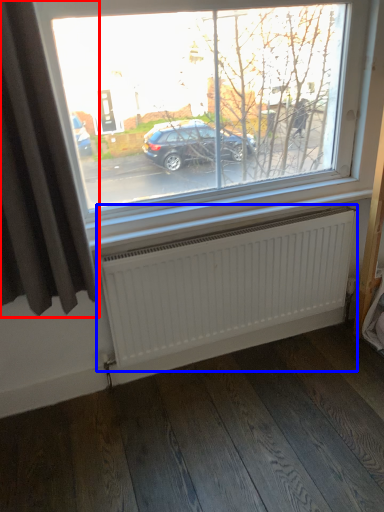
Question: Which object appears farthest to the camera in this image, curtain (highlighted by a red box) or radiator (highlighted by a blue box)?

Choices:
 (A) curtain
 (B) radiator

Answer: (B)